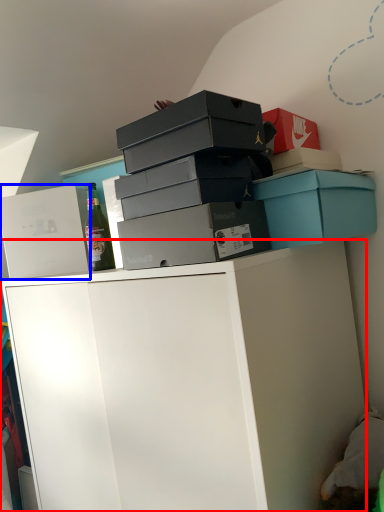
Question: Which point is further to the camera, cabinetry (highlighted by a red box) or box (highlighted by a blue box)?

Choices:
 (A) cabinetry
 (B) box

Answer: (B)